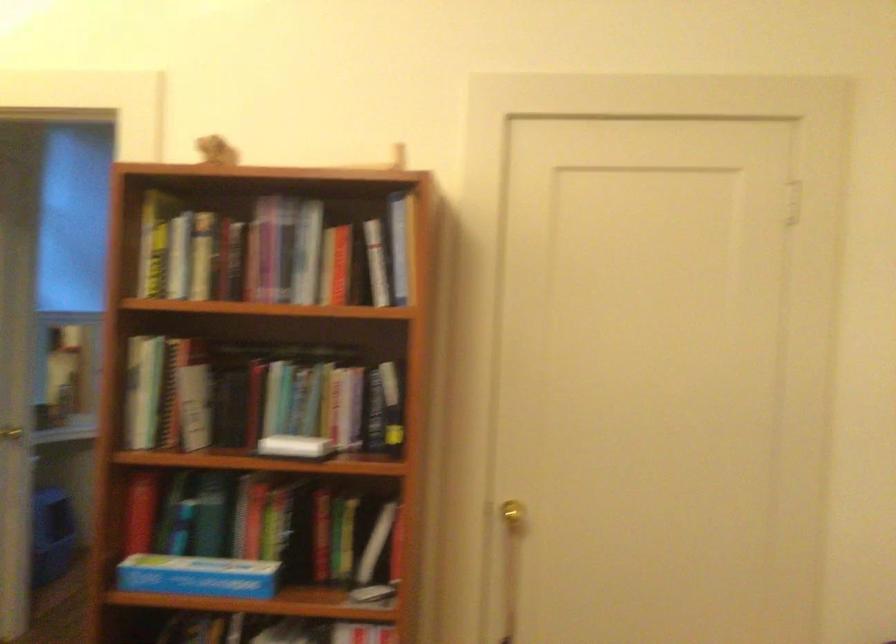
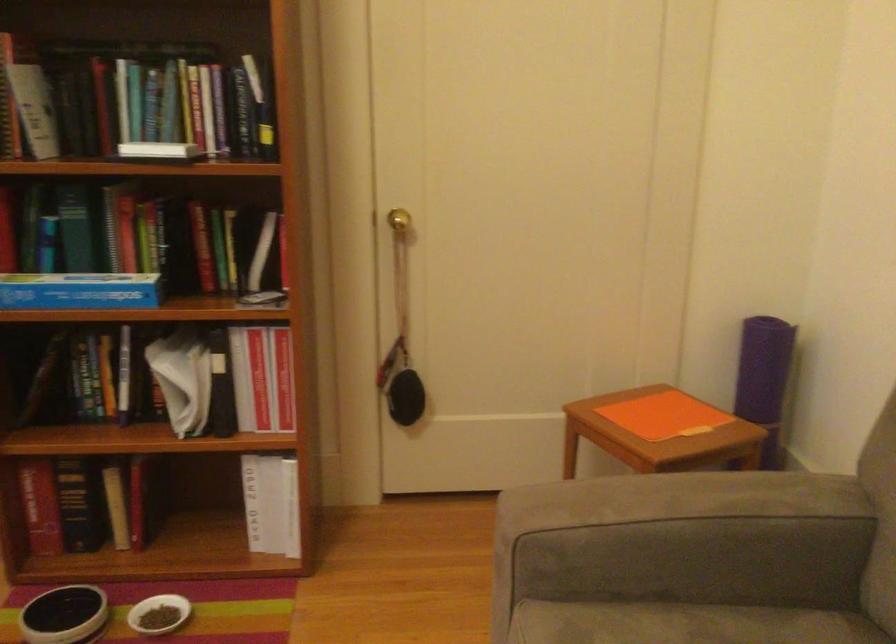
What movement of the cameraman would produce the second image?

The cameraman walked toward left, forward.